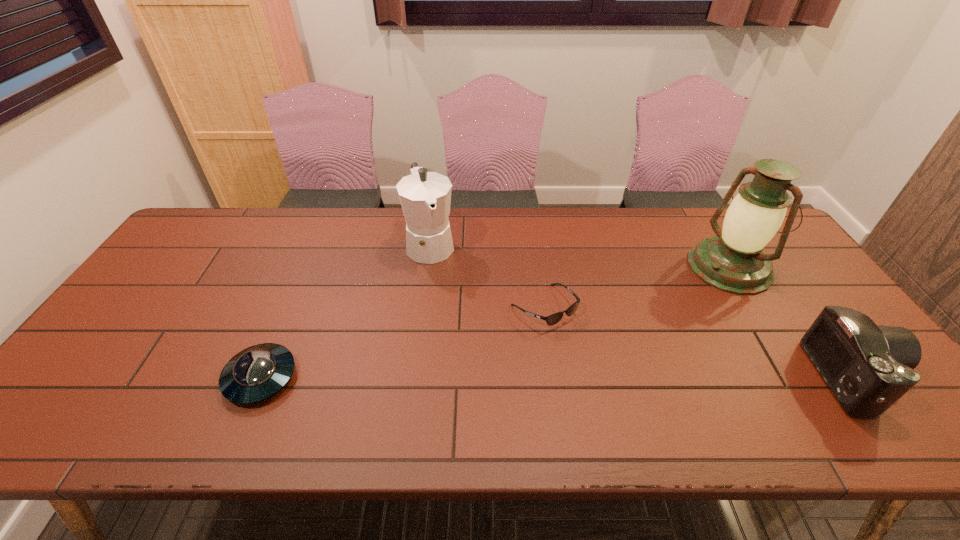
Image resolution: width=960 pixels, height=540 pixels. I want to click on vacant region located at the spout of the fourth object from right to left, so pos(447,298).

Locate an element on the screen. The image size is (960, 540). vacant space located 0.290m at the spout of the fourth object from right to left is located at coordinates (465, 341).

Locate an element on the screen. The image size is (960, 540). free point located 0.280m at the spout of the fourth object from right to left is located at coordinates (463, 338).

This screenshot has width=960, height=540. I want to click on free space located with the light compartment facing forward on the tallest object, so click(x=650, y=317).

Image resolution: width=960 pixels, height=540 pixels. Identify the location of free point located 0.270m with the light compartment facing forward on the tallest object. (642, 321).

Locate an element on the screen. vacant space located with the light compartment facing forward on the tallest object is located at coordinates (664, 308).

Where is `coffeepot positioned at the far edge`? coffeepot positioned at the far edge is located at coordinates (425, 197).

You are a GUI agent. You are given a task and a screenshot of the screen. Output one action in this format:
    pyautogui.click(x=<x>, y=<y>)
    Task: Click on the lantern at the far edge
    
    Given the screenshot: What is the action you would take?
    pyautogui.click(x=733, y=261)

What are the coordinates of `saucer present at the near edge` in the screenshot? It's located at (258, 372).

Where is `camera located at the near edge`? camera located at the near edge is located at coordinates (868, 367).